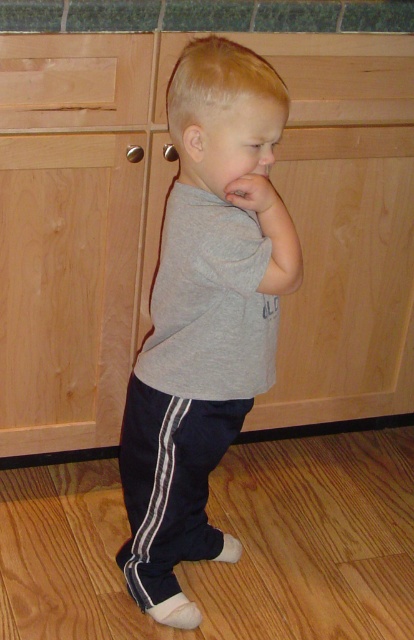
The child in the kitchen scene is trying to reach the beech wood drawer at upper left while holding their matte gray hand at center. Can the child fit their hand into the drawer?

The beech wood drawer at upper left is bigger than the matte gray hand at center, so yes, the child can fit their hand into the drawer.